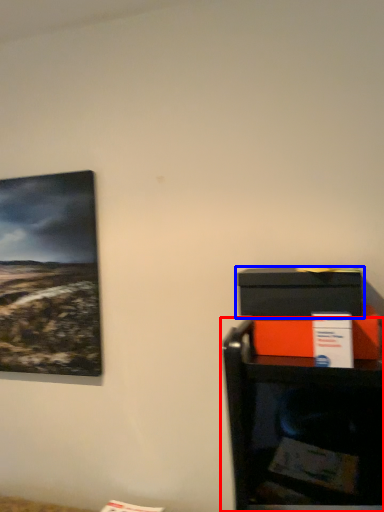
Question: Among these objects, which one is nearest to the camera, furniture (highlighted by a red box) or box (highlighted by a blue box)?

Choices:
 (A) furniture
 (B) box

Answer: (B)